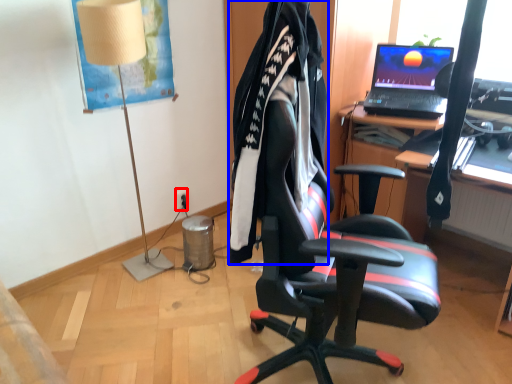
Question: Which of the following is the farthest to the observer, power outlet (highlighted by a red box) or clothing (highlighted by a blue box)?

Choices:
 (A) power outlet
 (B) clothing

Answer: (A)